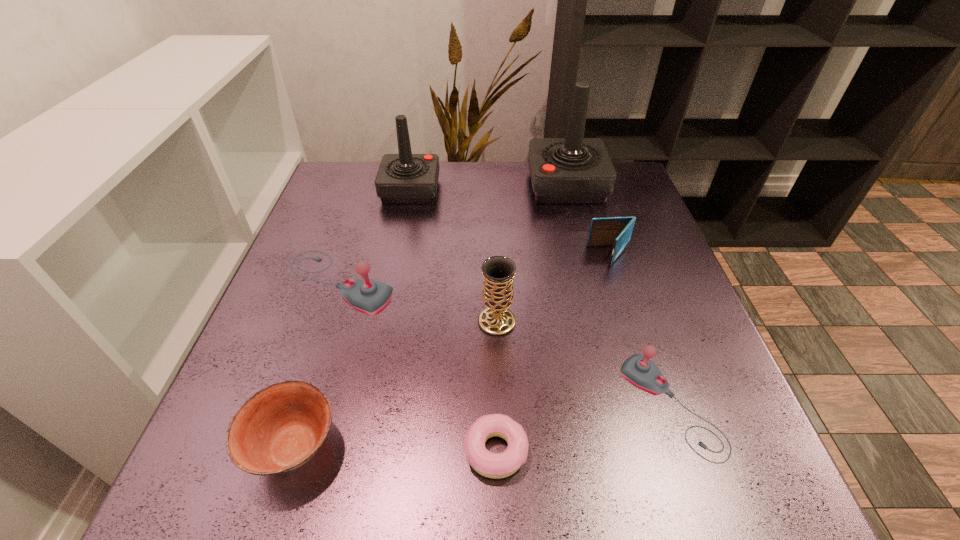
Select which object is the closest to the nearest joystick. Please provide its 2D coordinates. Your answer should be formatted as a tuple, i.e. [(x, y)], where the tuple contains the x and y coordinates of a point satisfying the conditions above.

[(493, 465)]

What are the coordinates of `joystick that is the third nearest to the second shortest joystick` in the screenshot? It's located at (638, 370).

Find the location of a particular element. The width and height of the screenshot is (960, 540). the closest joystick to the chalice is located at coordinates (368, 296).

At what (x,y) coordinates should I click in order to perform the action: click on vacant space that satisfies the following two spatial constraints: 1. on the front-facing side of the nearest joystick; 2. on the left side of the bigger red joystick. Please return your answer as a coordinate pair (x, y). The height and width of the screenshot is (540, 960). Looking at the image, I should click on (624, 406).

Identify the location of free space that satisfies the following two spatial constraints: 1. on the exterior surface of the right gray joystick; 2. on the left side of the wallet. (659, 406).

Locate an element on the screen. The height and width of the screenshot is (540, 960). vacant point that satisfies the following two spatial constraints: 1. on the exterior surface of the wallet; 2. on the back side of the nearer gray joystick is located at coordinates (659, 406).